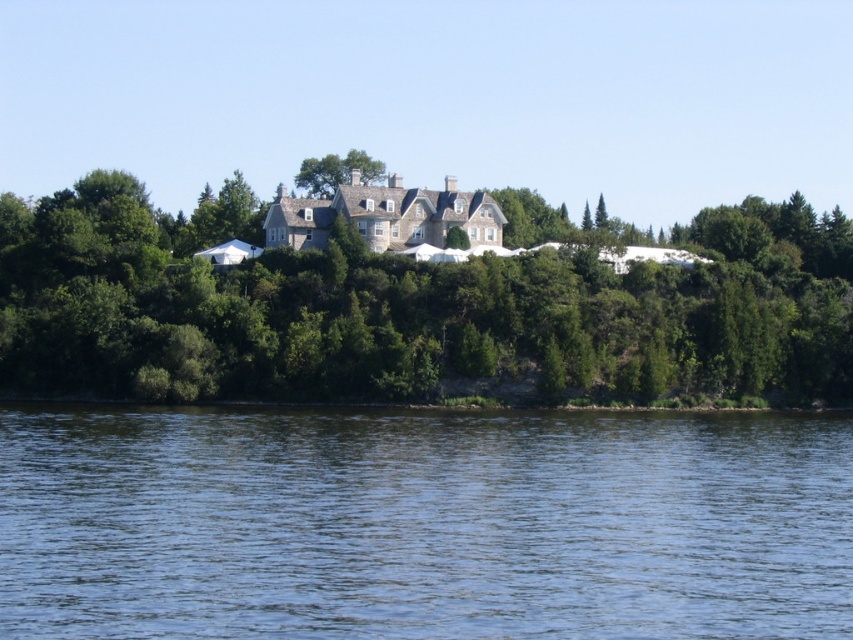
Locate an element on the screen. Image resolution: width=853 pixels, height=640 pixels. blue liquid water at lower center is located at coordinates (422, 524).

Does point (366, 628) come in front of point (469, 362)?

Yes, point (366, 628) is closer to viewer.

I want to click on blue liquid water at lower center, so click(422, 524).

Can you confirm if blue liquid water at lower center is bigger than green leafy tree at upper center?

No, blue liquid water at lower center is not bigger than green leafy tree at upper center.

Between blue liquid water at lower center and green leafy tree at upper center, which one has less height?

blue liquid water at lower center

Between point (136, 508) and point (312, 189), which one is positioned behind?

Point (312, 189)

You are a GUI agent. You are given a task and a screenshot of the screen. Output one action in this format:
    pyautogui.click(x=<x>, y=<y>)
    Task: Click on the blue liquid water at lower center
    Image resolution: width=853 pixels, height=640 pixels.
    Given the screenshot: What is the action you would take?
    pyautogui.click(x=422, y=524)

Can you confirm if green leafy tree at center is positioned to the left of green leafy tree at upper center?

No, green leafy tree at center is not to the left of green leafy tree at upper center.

Does green leafy tree at center have a greater height compared to green leafy tree at upper center?

Yes, green leafy tree at center is taller than green leafy tree at upper center.

The image size is (853, 640). What are the coordinates of `green leafy tree at center` in the screenshot? It's located at (409, 305).